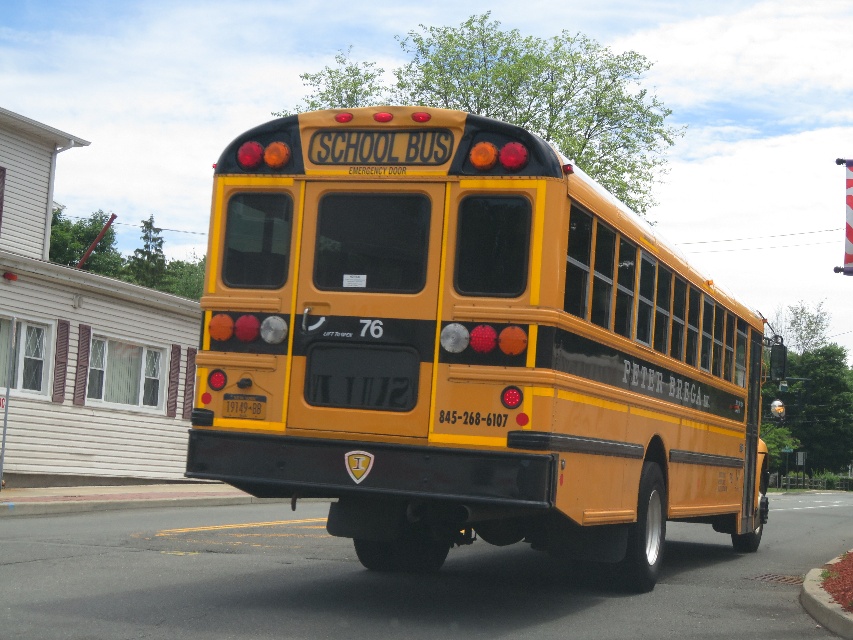
You are a delivery driver who needs to park your truck behind the yellow school bus. The truck requires a clear space of 3 meters behind the bus. Can you determine if there is enough space between the concrete at lower right and the yellow matte license plate at center to park your truck?

The concrete at lower right is positioned under the yellow matte license plate at center, which means they are vertically aligned. Since the truck needs a clear space of 3 meters behind the bus horizontally, the vertical positioning does not affect the required space. Therefore, there is likely enough space to park the truck behind the bus.